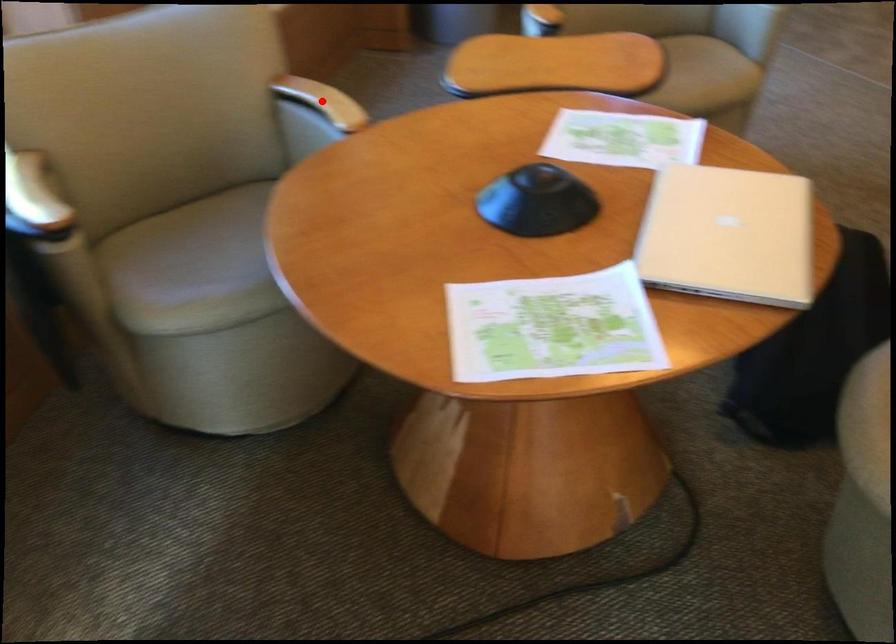
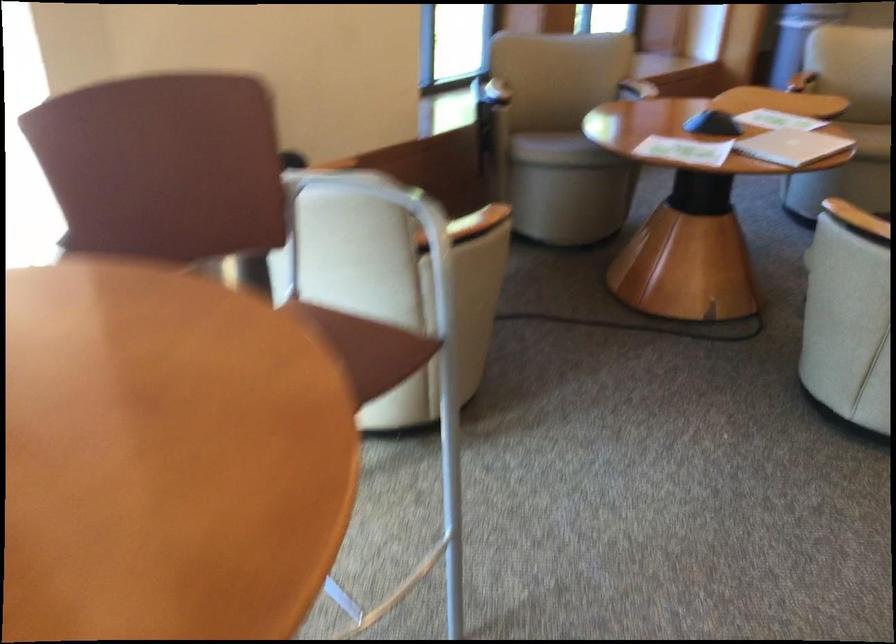
Question: I am providing you with two images of the same scene from different viewpoints. A red point is marked on the first image. Is the red point's position out of view in image 2?

Choices:
 (A) Yes
 (B) No

Answer: (A)